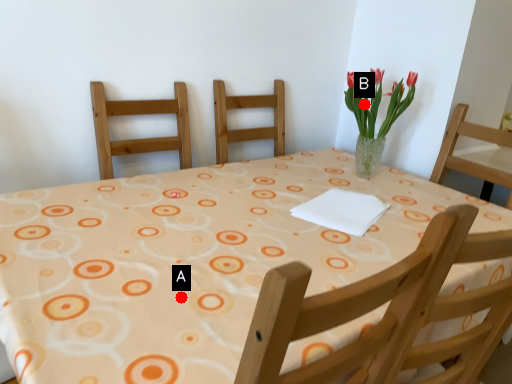
Question: Two points are circled on the image, labeled by A and B beside each circle. Among these points, which one is nearest to the camera?

Choices:
 (A) A is closer
 (B) B is closer

Answer: (A)